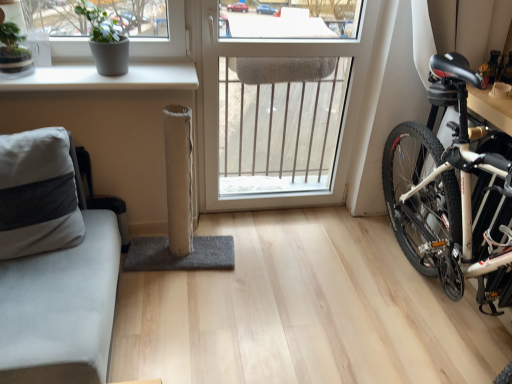
Question: From a real-world perspective, is gray matte pot at upper left positioned above or below gray fabric couch at left?

Choices:
 (A) below
 (B) above

Answer: (B)

Question: From their relative heights in the image, would you say gray matte pot at upper left is taller or shorter than gray fabric couch at left?

Choices:
 (A) tall
 (B) short

Answer: (B)

Question: Based on their relative distances, which object is nearer to the white matte window sill at upper left?

Choices:
 (A) gray matte pot at upper left
 (B) white plastic window at center
 (C) gray fabric couch at left

Answer: (A)

Question: Which object is positioned farthest from the gray fabric couch at left?

Choices:
 (A) white matte window sill at upper left
 (B) gray matte pot at upper left
 (C) white plastic window at center

Answer: (C)